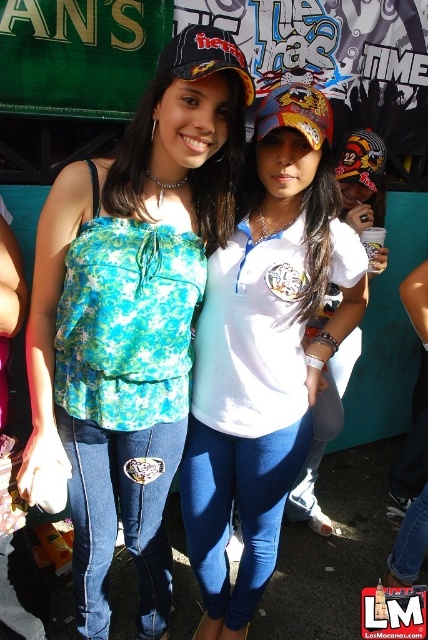
You are a photographer trying to capture a clear shot of the white matte shirt at center and the black matte baseball cap at center. Which object is positioned lower in the image?

The white matte shirt at center is below the black matte baseball cap at center, so the white matte shirt at center is positioned lower in the image.

You are a photographer trying to capture a clear shot of both the white matte shirt at center and the black matte baseball cap at center. Since the camera can only focus on one object at a time, which object should you choose to ensure the larger one is in focus?

The white matte shirt at center is larger in size than the black matte baseball cap at center, so you should focus on the white matte shirt at center to ensure the larger object is in focus.